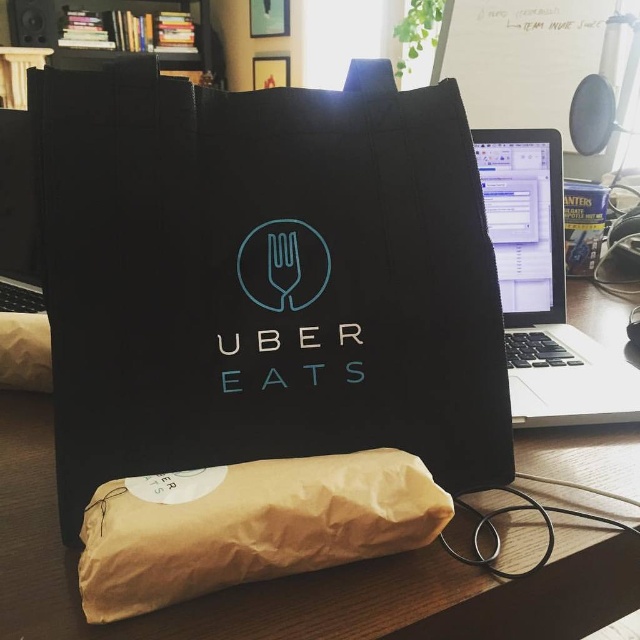
Question: Which of the following is the closest to the observer?

Choices:
 (A) brown paper bag at lower center
 (B) black matte bag at center
 (C) black matte logo at center

Answer: (A)

Question: Does brown paper bag at lower center appear under black matte logo at center?

Choices:
 (A) yes
 (B) no

Answer: (A)

Question: From the image, what is the correct spatial relationship of brown paper bag at lower center in relation to black matte logo at center?

Choices:
 (A) below
 (B) above

Answer: (A)

Question: Is black canvas tote bag at center positioned at the back of black matte logo at center?

Choices:
 (A) yes
 (B) no

Answer: (B)

Question: Which point is closer to the camera?

Choices:
 (A) coord(560,385)
 (B) coord(118,586)
 (C) coord(264,298)
 (D) coord(145,620)

Answer: (B)

Question: Which of the following is the closest to the observer?

Choices:
 (A) (307, 282)
 (B) (540, 598)

Answer: (B)